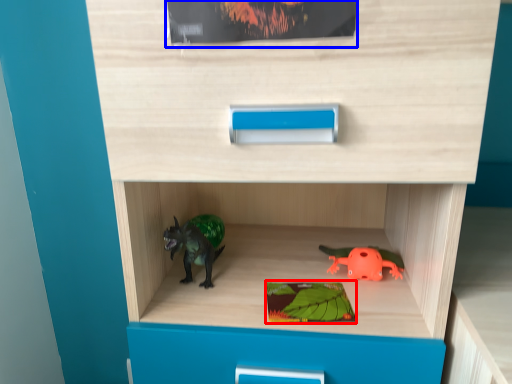
Question: Which point is closer to the camera, paperback book (highlighted by a red box) or paperback book (highlighted by a blue box)?

Choices:
 (A) paperback book
 (B) paperback book

Answer: (B)